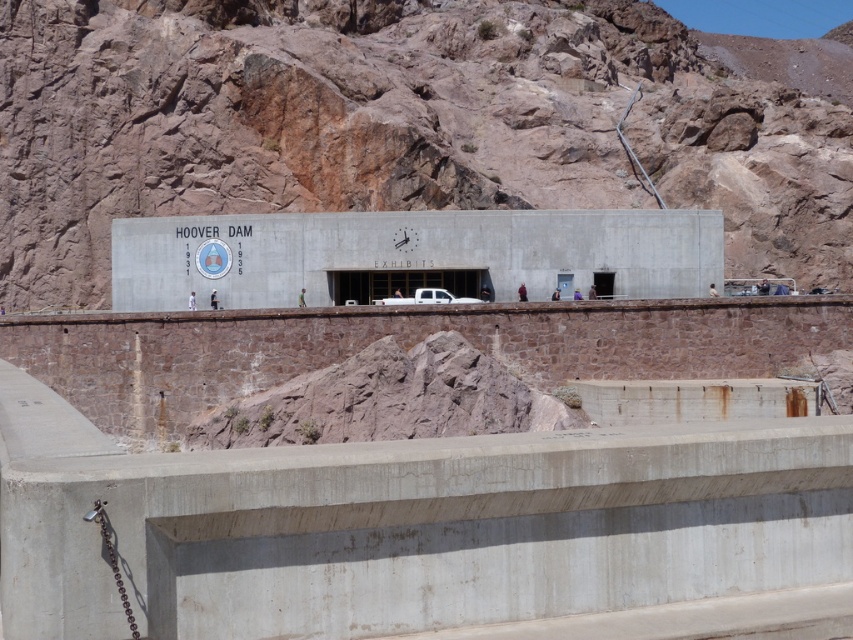
Between rustic rock mountain at upper center and white matte truck at center, which one is positioned lower?

white matte truck at center is below.

This screenshot has height=640, width=853. What do you see at coordinates (392, 124) in the screenshot? I see `rustic rock mountain at upper center` at bounding box center [392, 124].

Find the location of a particular element. rustic rock mountain at upper center is located at coordinates (392, 124).